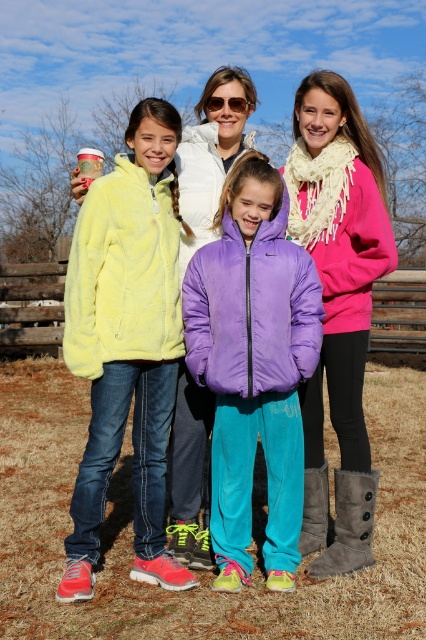
Question: Which is nearer to the brown suede boot at lower center?

Choices:
 (A) yellow fleece jacket at left
 (B) matte black sunglasses at center

Answer: (A)

Question: Which of the following is the farthest from the observer?

Choices:
 (A) (216, 356)
 (B) (365, 500)

Answer: (B)

Question: Does matte pink jacket at center have a greater width compared to gray suede boot at lower right?

Choices:
 (A) yes
 (B) no

Answer: (A)

Question: Is fluffy yellow jacket at left thinner than matte pink jacket at center?

Choices:
 (A) yes
 (B) no

Answer: (B)

Question: Which of these objects is positioned closest to the fluffy yellow jacket at left?

Choices:
 (A) pink fleece jacket at center
 (B) purple down jacket at center

Answer: (B)

Question: From the image, what is the correct spatial relationship of fluffy yellow jacket at left in relation to matte yellow jacket at left?

Choices:
 (A) left
 (B) right

Answer: (A)